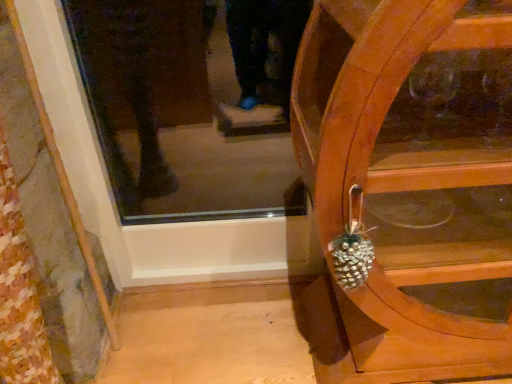
Locate an element on the screen. wooden cabinet at right is located at coordinates (410, 185).

Image resolution: width=512 pixels, height=384 pixels. Describe the element at coordinates (410, 185) in the screenshot. I see `wooden cabinet at right` at that location.

Measure the distance between point (414, 267) and camera.

The depth of point (414, 267) is 1.00 meters.

You are a GUI agent. You are given a task and a screenshot of the screen. Output one action in this format:
    pyautogui.click(x=<x>, y=<y>)
    Task: Click on the shiny metallic pinecone at right
    
    Given the screenshot: What is the action you would take?
    pyautogui.click(x=352, y=246)

The image size is (512, 384). Describe the element at coordinates (352, 246) in the screenshot. I see `shiny metallic pinecone at right` at that location.

I want to click on wooden cabinet at right, so click(x=410, y=185).

Based on their positions, is shiny metallic pinecone at right located to the left or right of wooden cabinet at right?

shiny metallic pinecone at right is positioned on wooden cabinet at right's left side.

In the image, is shiny metallic pinecone at right positioned in front of or behind wooden cabinet at right?

Clearly, shiny metallic pinecone at right is behind wooden cabinet at right.

Is point (339, 244) closer to viewer compared to point (413, 57)?

That is False.

From the image's perspective, is shiny metallic pinecone at right beneath wooden cabinet at right?

Indeed, from the image's perspective, shiny metallic pinecone at right is shown beneath wooden cabinet at right.

From a real-world perspective, between shiny metallic pinecone at right and wooden cabinet at right, who is vertically higher?

shiny metallic pinecone at right is physically above.

Based on the photo, does shiny metallic pinecone at right have a greater width compared to wooden cabinet at right?

In fact, shiny metallic pinecone at right might be narrower than wooden cabinet at right.

Based on the photo, considering the sizes of objects shiny metallic pinecone at right and wooden cabinet at right in the image provided, who is shorter, shiny metallic pinecone at right or wooden cabinet at right?

shiny metallic pinecone at right.

Considering the relative sizes of shiny metallic pinecone at right and wooden cabinet at right in the image provided, is shiny metallic pinecone at right smaller than wooden cabinet at right?

Indeed, shiny metallic pinecone at right has a smaller size compared to wooden cabinet at right.

Is shiny metallic pinecone at right situated inside wooden cabinet at right or outside?

The correct answer is: outside.

Would you consider shiny metallic pinecone at right to be distant from wooden cabinet at right?

That's not correct — shiny metallic pinecone at right is a little close to wooden cabinet at right.

Does shiny metallic pinecone at right turn towards wooden cabinet at right?

No, shiny metallic pinecone at right is not facing towards wooden cabinet at right.

Can you tell me how much shiny metallic pinecone at right and wooden cabinet at right differ in facing direction?

They differ by 1.92 degrees in their facing directions.

Identify the location of furniture lying in front of the shiny metallic pinecone at right. Image resolution: width=512 pixels, height=384 pixels. (410, 185).

Which object is positioned more to the left, wooden cabinet at right or shiny metallic pinecone at right?

From the viewer's perspective, shiny metallic pinecone at right appears more on the left side.

Considering their positions, is wooden cabinet at right located in front of or behind shiny metallic pinecone at right?

Visually, wooden cabinet at right is located in front of shiny metallic pinecone at right.

Does point (493, 316) appear closer or farther from the camera than point (341, 257)?

Clearly, point (493, 316) is more distant from the camera than point (341, 257).

From the image's perspective, is wooden cabinet at right above or below shiny metallic pinecone at right?

wooden cabinet at right is above shiny metallic pinecone at right.

From a real-world perspective, is wooden cabinet at right above or below shiny metallic pinecone at right?

wooden cabinet at right is situated lower than shiny metallic pinecone at right in the real world.

Is wooden cabinet at right thinner than shiny metallic pinecone at right?

No, wooden cabinet at right is not thinner than shiny metallic pinecone at right.

Who is shorter, wooden cabinet at right or shiny metallic pinecone at right?

shiny metallic pinecone at right is shorter.

Considering the sizes of objects wooden cabinet at right and shiny metallic pinecone at right in the image provided, who is bigger, wooden cabinet at right or shiny metallic pinecone at right?

wooden cabinet at right is bigger.

Based on the photo, which is correct: wooden cabinet at right is inside shiny metallic pinecone at right, or outside of it?

wooden cabinet at right is not enclosed by shiny metallic pinecone at right.

Is wooden cabinet at right positioned far away from shiny metallic pinecone at right?

That's not correct — wooden cabinet at right is a little close to shiny metallic pinecone at right.

Could you tell me if wooden cabinet at right is turned towards shiny metallic pinecone at right?

Yes, wooden cabinet at right faces towards shiny metallic pinecone at right.

Where is `pineapple behind the wooden cabinet at right`? The image size is (512, 384). pineapple behind the wooden cabinet at right is located at coordinates (352, 246).

The image size is (512, 384). I want to click on pineapple that appears on the left of wooden cabinet at right, so click(x=352, y=246).

This screenshot has height=384, width=512. Find the location of `pineapple above the wooden cabinet at right (from a real-world perspective)`. pineapple above the wooden cabinet at right (from a real-world perspective) is located at coordinates (352, 246).